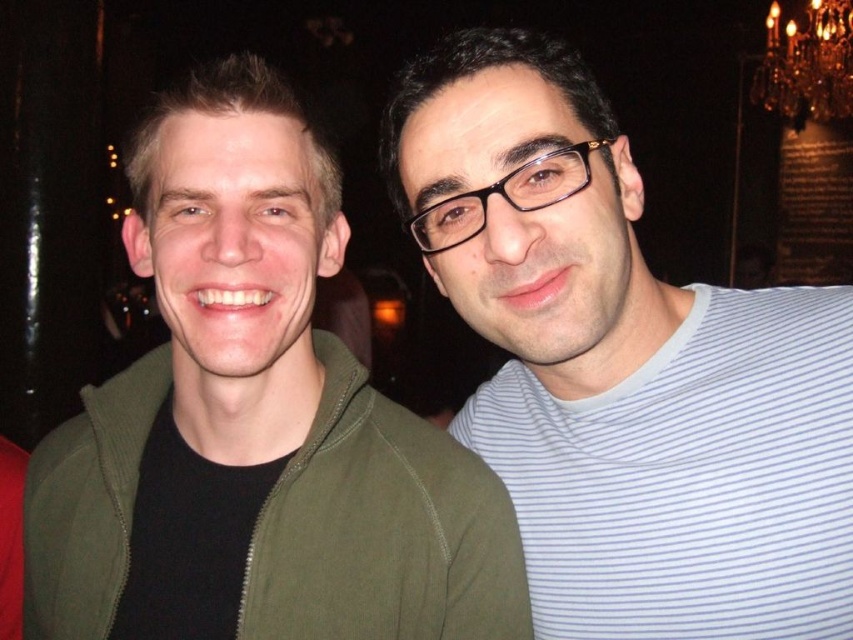
You are a photographer adjusting your camera settings in a dimly lit venue. You notice the green matte jacket at left and the gold crystal chandelier at upper right. Which object would require a faster shutter speed to avoid blur due to its size in the frame?

The green matte jacket at left is smaller than the gold crystal chandelier at upper right. Since smaller objects may require faster shutter speeds to capture sharp details, the photographer should use a faster shutter speed for the green matte jacket at left.

You are standing in a dimly lit indoor venue with a chandelier above. You see a person on the left wearing a dark green zip up jacket and a person on the right wearing a light blue and white horizontally striped long sleeve shirt. There is a point at coordinates (689, 477). Is this point located on the white striped t shirt at right?

The white striped t shirt at right is represented by point (689, 477), so yes, the point is located on the white striped t shirt at right.